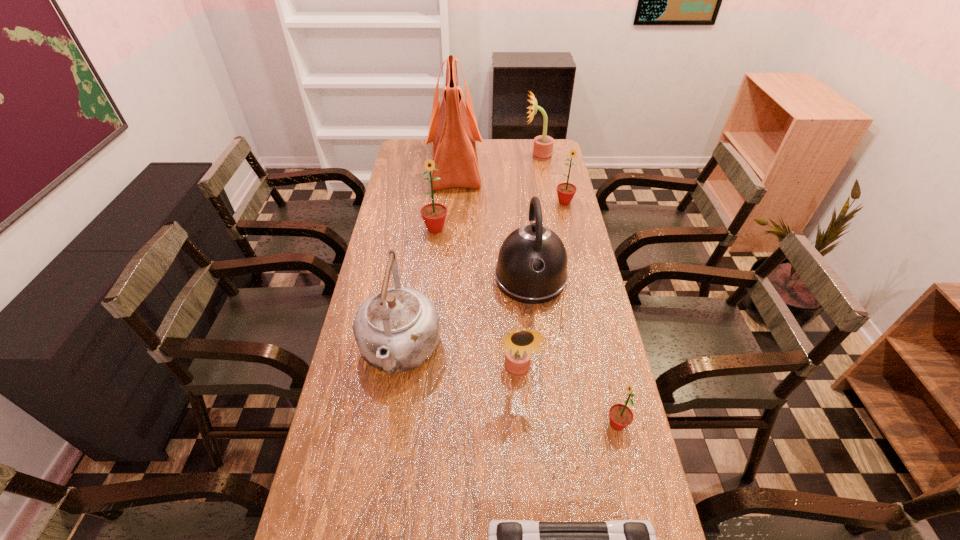
Locate an element on the screen. This screenshot has width=960, height=540. brown shopping bag is located at coordinates (453, 131).

At what (x,y) coordinates should I click in order to perform the action: click on shopping bag. Please return your answer as a coordinate pair (x, y). This screenshot has height=540, width=960. Looking at the image, I should click on (453, 131).

Locate an element on the screen. the farthest sunflower is located at coordinates (543, 145).

Locate an element on the screen. The image size is (960, 540). the bigger yellow sunflower is located at coordinates (543, 145).

At what (x,y) coordinates should I click in order to perform the action: click on the second farthest green sunflower. Please return your answer as a coordinate pair (x, y). Looking at the image, I should click on (434, 214).

This screenshot has height=540, width=960. Find the location of `the biggest green sunflower`. the biggest green sunflower is located at coordinates (434, 214).

Where is `the fifth nearest object`? The image size is (960, 540). the fifth nearest object is located at coordinates (532, 263).

This screenshot has width=960, height=540. Find the location of `black kettle`. black kettle is located at coordinates (532, 263).

Where is `the left kettle`? Image resolution: width=960 pixels, height=540 pixels. the left kettle is located at coordinates [x=397, y=329].

Image resolution: width=960 pixels, height=540 pixels. I want to click on the second biggest green sunflower, so click(566, 191).